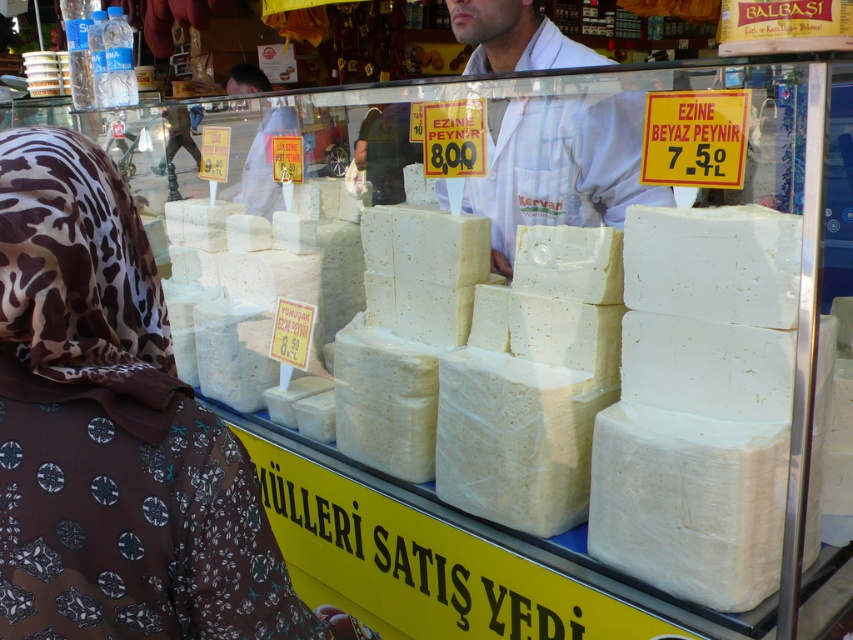
Can you confirm if white crumbly cheese at center is wider than white lab coat at center?

Yes, white crumbly cheese at center is wider than white lab coat at center.

In order to click on white crumbly cheese at center in this screenshot , I will do `click(699, 406)`.

In order to click on white crumbly cheese at center in this screenshot , I will do (699, 406).

Can you confirm if brown printed fabric at lower left is positioned to the left of white lab coat at center?

Correct, you'll find brown printed fabric at lower left to the left of white lab coat at center.

Which of these two, brown printed fabric at lower left or white lab coat at center, stands shorter?

brown printed fabric at lower left

Find the location of `brown printed fabric at lower left`. brown printed fabric at lower left is located at coordinates (114, 432).

Where is `brown printed fabric at lower left`? brown printed fabric at lower left is located at coordinates (114, 432).

Is brown printed fabric at lower left in front of white crumbly cheese at center?

Yes, brown printed fabric at lower left is in front of white crumbly cheese at center.

From the picture: Does brown printed fabric at lower left appear on the right side of white crumbly cheese at center?

Incorrect, brown printed fabric at lower left is not on the right side of white crumbly cheese at center.

Does point (202, 568) lie behind point (728, 259)?

No, (202, 568) is in front of (728, 259).

You are a GUI agent. You are given a task and a screenshot of the screen. Output one action in this format:
    pyautogui.click(x=<x>, y=<y>)
    Task: Click on the brown printed fabric at lower left
    This screenshot has height=640, width=853.
    Given the screenshot: What is the action you would take?
    pyautogui.click(x=114, y=432)